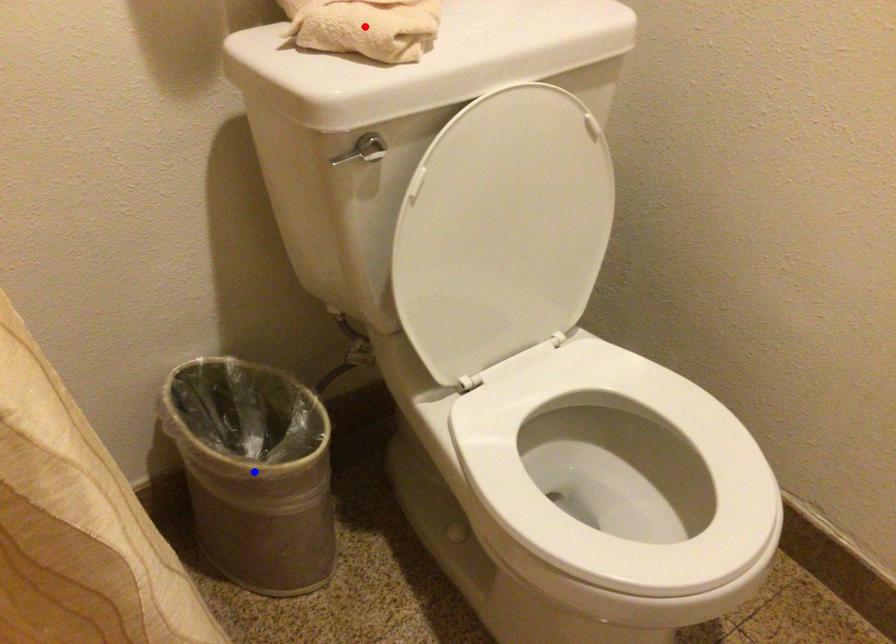
Question: In the image, two points are highlighted. Which point is nearer to the camera? Reply with the corresponding letter.

Choices:
 (A) blue point
 (B) red point

Answer: (B)